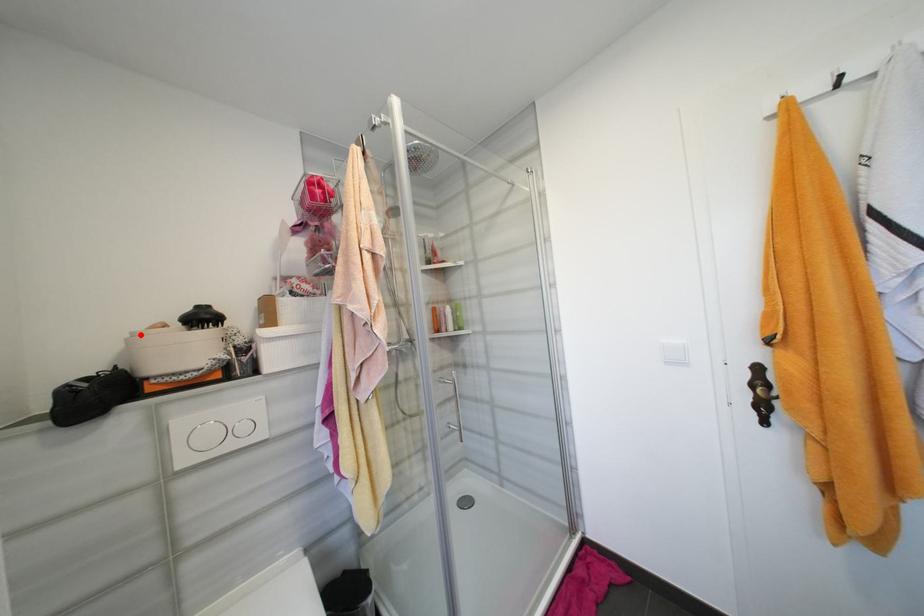
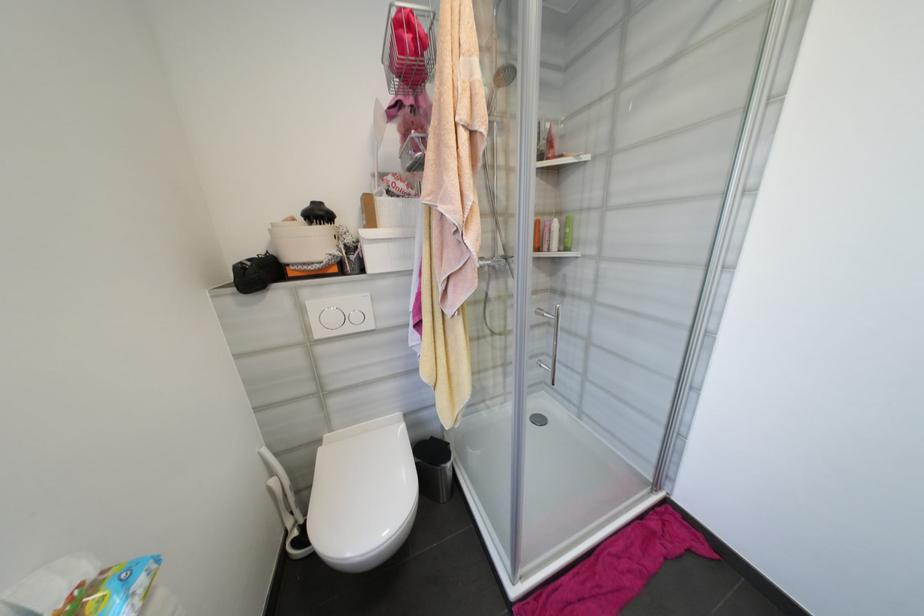
In the second image, find the point that corresponds to the highlighted location in the first image.

(280, 225)